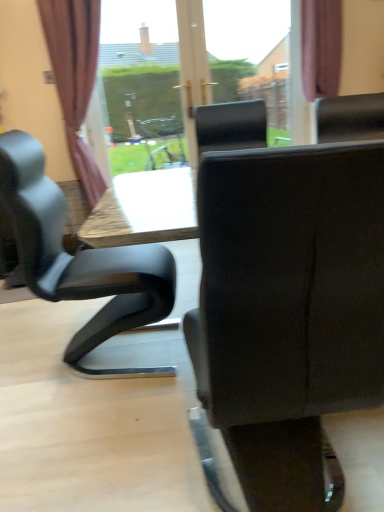
Question: Is purple fabric curtain at upper right, arranged as the 1th curtain when viewed from the right, positioned with its back to matte black chair at center?

Choices:
 (A) yes
 (B) no

Answer: (B)

Question: Can you confirm if purple fabric curtain at upper right, which is the 2th curtain from left to right, is positioned to the left of matte black chair at center?

Choices:
 (A) yes
 (B) no

Answer: (B)

Question: Can you confirm if purple fabric curtain at upper right, which is the 2th curtain from left to right, is shorter than matte black chair at center?

Choices:
 (A) yes
 (B) no

Answer: (A)

Question: Is purple fabric curtain at upper right, which is the 2th curtain from left to right, located outside matte black chair at center?

Choices:
 (A) no
 (B) yes

Answer: (B)

Question: Can you confirm if purple fabric curtain at upper right, arranged as the 1th curtain when viewed from the right, is positioned to the right of matte black chair at center?

Choices:
 (A) yes
 (B) no

Answer: (A)

Question: Considering the relative sizes of purple fabric curtain at upper right, which is the 2th curtain from left to right, and matte black chair at center in the image provided, is purple fabric curtain at upper right, which is the 2th curtain from left to right, thinner than matte black chair at center?

Choices:
 (A) no
 (B) yes

Answer: (B)

Question: Is brown fabric curtain at left, the 1th curtain from the left, not within matte black chair at center?

Choices:
 (A) yes
 (B) no

Answer: (A)

Question: Does brown fabric curtain at left, the 1th curtain from the left, have a larger size compared to matte black chair at center?

Choices:
 (A) no
 (B) yes

Answer: (A)

Question: Considering the relative sizes of brown fabric curtain at left, placed as the 2th curtain when sorted from right to left, and matte black chair at center in the image provided, is brown fabric curtain at left, placed as the 2th curtain when sorted from right to left, smaller than matte black chair at center?

Choices:
 (A) no
 (B) yes

Answer: (B)

Question: Is brown fabric curtain at left, placed as the 2th curtain when sorted from right to left, at the right side of matte black chair at center?

Choices:
 (A) yes
 (B) no

Answer: (B)

Question: Is brown fabric curtain at left, placed as the 2th curtain when sorted from right to left, facing away from matte black chair at center?

Choices:
 (A) no
 (B) yes

Answer: (A)

Question: From a real-world perspective, is brown fabric curtain at left, the 1th curtain from the left, below matte black chair at center?

Choices:
 (A) yes
 (B) no

Answer: (B)

Question: Considering the relative sizes of purple fabric curtain at upper right, which is the 2th curtain from left to right, and brown fabric curtain at left, placed as the 2th curtain when sorted from right to left, in the image provided, is purple fabric curtain at upper right, which is the 2th curtain from left to right, smaller than brown fabric curtain at left, placed as the 2th curtain when sorted from right to left,?

Choices:
 (A) yes
 (B) no

Answer: (A)